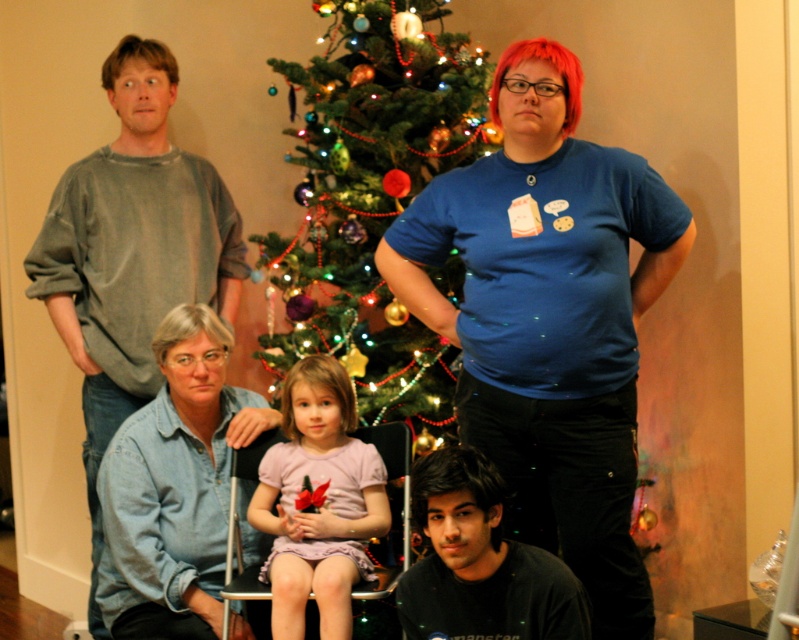
Question: Observing the image, what is the correct spatial positioning of green textured christmas tree at center in reference to black matte shirt at lower center?

Choices:
 (A) below
 (B) above

Answer: (B)

Question: Considering the real-world distances, which object is farthest from the green textured christmas tree at center?

Choices:
 (A) blue t-shirt at upper center
 (B) pink fabric dress at center

Answer: (A)

Question: Is green textured christmas tree at center closer to camera compared to blue denim shirt at lower left?

Choices:
 (A) yes
 (B) no

Answer: (B)

Question: Which of the following is the farthest from the observer?

Choices:
 (A) black matte shirt at lower center
 (B) green textured christmas tree at center

Answer: (B)

Question: Among these objects, which one is nearest to the camera?

Choices:
 (A) gray cotton shirt at upper left
 (B) green textured christmas tree at center
 (C) blue t-shirt at upper center
 (D) pink fabric dress at center

Answer: (C)

Question: Is blue t-shirt at upper center to the right of pink fabric dress at center from the viewer's perspective?

Choices:
 (A) yes
 (B) no

Answer: (A)